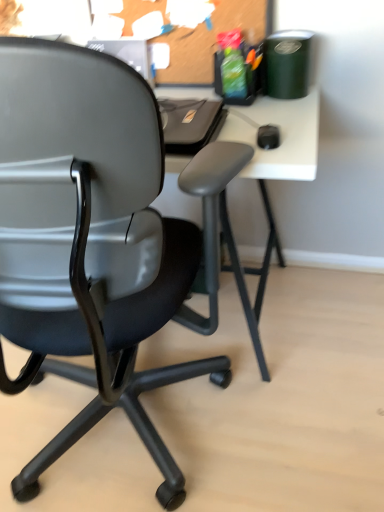
The image size is (384, 512). What do you see at coordinates (207, 40) in the screenshot? I see `burlap corkboard at upper center` at bounding box center [207, 40].

The image size is (384, 512). What are the coordinates of `burlap corkboard at upper center` in the screenshot? It's located at (207, 40).

Measure the distance between burlap corkboard at upper center and camera.

burlap corkboard at upper center and camera are 1.25 meters apart from each other.

The image size is (384, 512). Describe the element at coordinates (88, 234) in the screenshot. I see `matte black chair at left` at that location.

Where is `matte black chair at left`? The image size is (384, 512). matte black chair at left is located at coordinates (88, 234).

What is the approximate height of matte black chair at left?

The height of matte black chair at left is 73.84 centimeters.

Locate an element on the screen. This screenshot has width=384, height=512. burlap corkboard at upper center is located at coordinates (207, 40).

Which is more to the right, matte black chair at left or burlap corkboard at upper center?

burlap corkboard at upper center is more to the right.

Which object is closer to the camera, matte black chair at left or burlap corkboard at upper center?

matte black chair at left is in front.

Does point (127, 86) appear closer or farther from the camera than point (263, 18)?

Clearly, point (127, 86) is closer to the camera than point (263, 18).

From the image's perspective, is matte black chair at left below burlap corkboard at upper center?

Indeed, from the image's perspective, matte black chair at left is shown beneath burlap corkboard at upper center.

From a real-world perspective, is matte black chair at left located higher than burlap corkboard at upper center?

Incorrect, from a real-world perspective, matte black chair at left is lower than burlap corkboard at upper center.

In terms of width, does matte black chair at left look wider or thinner when compared to burlap corkboard at upper center?

matte black chair at left is wider than burlap corkboard at upper center.

Considering the sizes of matte black chair at left and burlap corkboard at upper center in the image, is matte black chair at left taller or shorter than burlap corkboard at upper center?

Clearly, matte black chair at left is taller compared to burlap corkboard at upper center.

Between matte black chair at left and burlap corkboard at upper center, which one has larger size?

matte black chair at left is bigger.

Is matte black chair at left outside of burlap corkboard at upper center?

Absolutely, matte black chair at left is external to burlap corkboard at upper center.

Would you say matte black chair at left is a long distance from burlap corkboard at upper center?

No.

Is matte black chair at left facing towards burlap corkboard at upper center?

No, matte black chair at left does not turn towards burlap corkboard at upper center.

This screenshot has width=384, height=512. What are the coordinates of `chair that is on the left side of burlap corkboard at upper center` in the screenshot? It's located at (88, 234).

Considering the relative positions of burlap corkboard at upper center and matte black chair at left in the image provided, is burlap corkboard at upper center to the left of matte black chair at left from the viewer's perspective?

Incorrect, burlap corkboard at upper center is not on the left side of matte black chair at left.

In the image, is burlap corkboard at upper center positioned in front of or behind matte black chair at left?

Clearly, burlap corkboard at upper center is behind matte black chair at left.

Considering the positions of points (123, 10) and (38, 311), is point (123, 10) closer to camera compared to point (38, 311)?

No.

From the image's perspective, is burlap corkboard at upper center located above matte black chair at left?

Yes, from the image's perspective, burlap corkboard at upper center is over matte black chair at left.

From a real-world perspective, which is physically below, burlap corkboard at upper center or matte black chair at left?

matte black chair at left.

Looking at their sizes, would you say burlap corkboard at upper center is wider or thinner than matte black chair at left?

Considering their sizes, burlap corkboard at upper center looks slimmer than matte black chair at left.

Considering the sizes of objects burlap corkboard at upper center and matte black chair at left in the image provided, who is taller, burlap corkboard at upper center or matte black chair at left?

With more height is matte black chair at left.

Looking at the image, does burlap corkboard at upper center seem bigger or smaller compared to matte black chair at left?

Considering their sizes, burlap corkboard at upper center takes up less space than matte black chair at left.

Is matte black chair at left inside burlap corkboard at upper center?

No, matte black chair at left is not inside burlap corkboard at upper center.

Are burlap corkboard at upper center and matte black chair at left making contact?

No, burlap corkboard at upper center is not making contact with matte black chair at left.

Does burlap corkboard at upper center turn towards matte black chair at left?

No.

Where is `chair below the burlap corkboard at upper center (from a real-world perspective)`? chair below the burlap corkboard at upper center (from a real-world perspective) is located at coordinates (88, 234).

Locate an element on the screen. Image resolution: width=384 pixels, height=512 pixels. bulletin board above the matte black chair at left (from the image's perspective) is located at coordinates (207, 40).

The height and width of the screenshot is (512, 384). Identify the location of bulletin board above the matte black chair at left (from a real-world perspective). (207, 40).